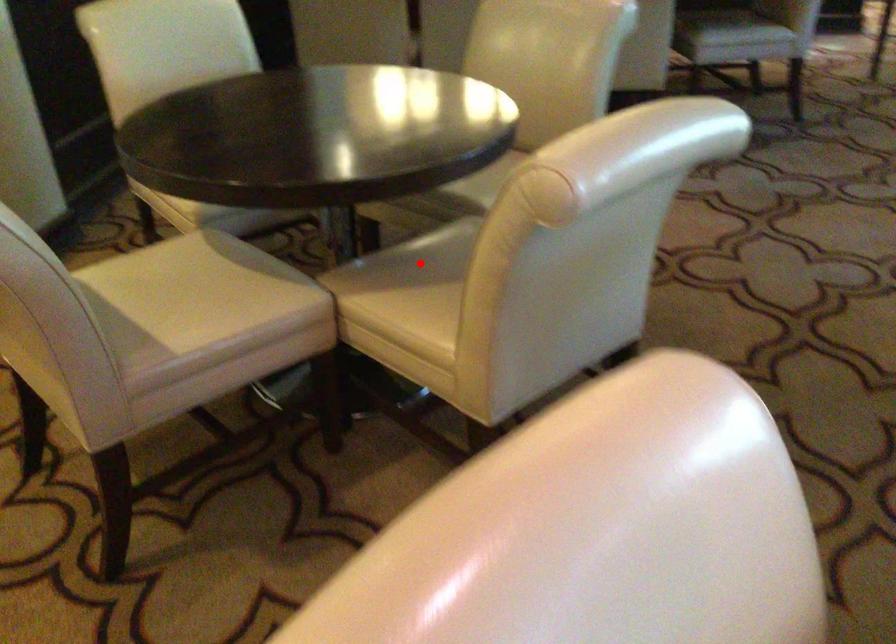
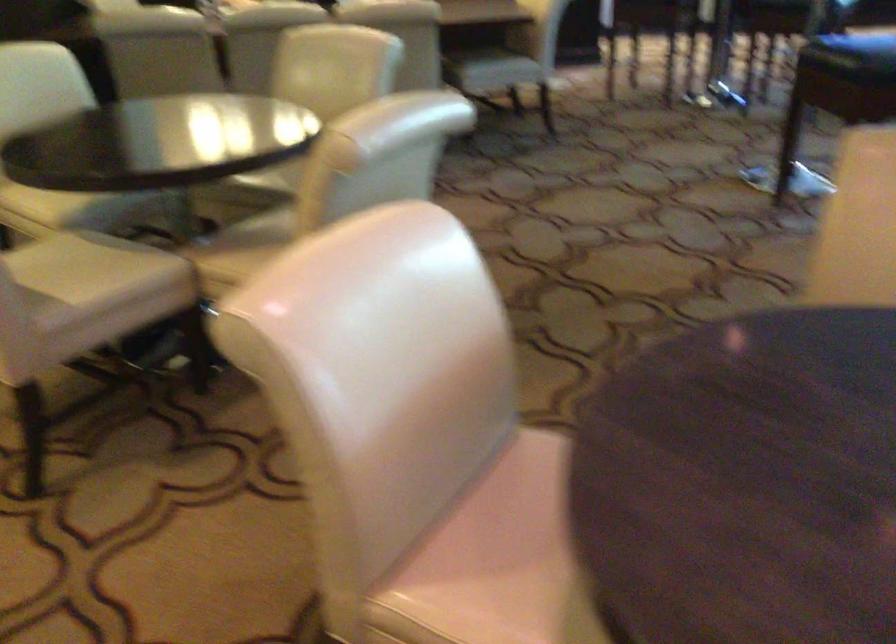
In the second image, find the point that corresponds to the highlighted location in the first image.

(259, 234)